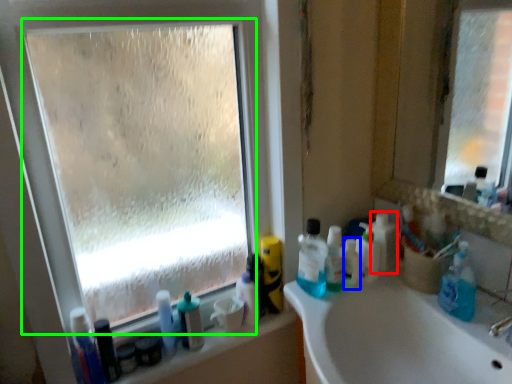
Question: Which object is the farthest from toiletry (highlighted by a red box)? Choose among these: mouthwash (highlighted by a blue box) or glass window (highlighted by a green box).

Choices:
 (A) mouthwash
 (B) glass window

Answer: (B)